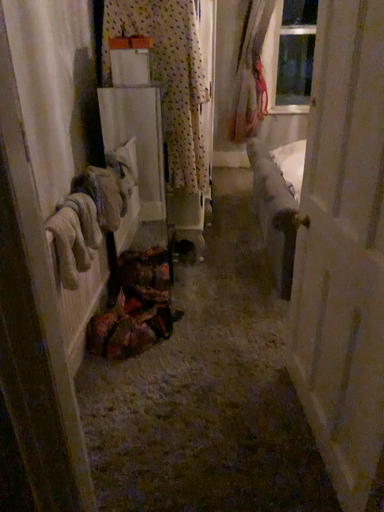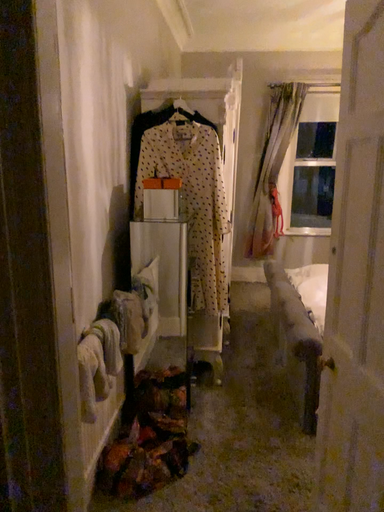
Question: Which way did the camera rotate in the video?

Choices:
 (A) rotated upward
 (B) rotated downward

Answer: (A)